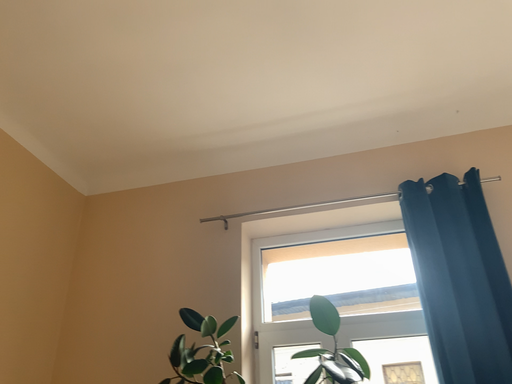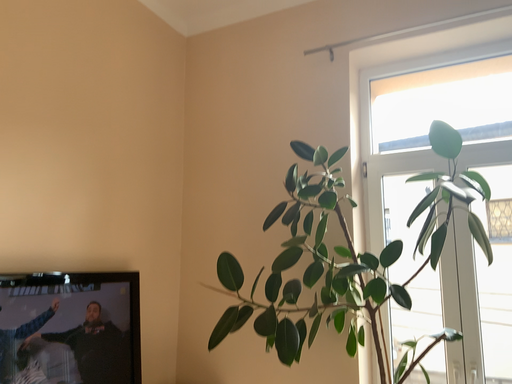
Question: Which way did the camera rotate in the video?

Choices:
 (A) rotated left
 (B) rotated right

Answer: (A)